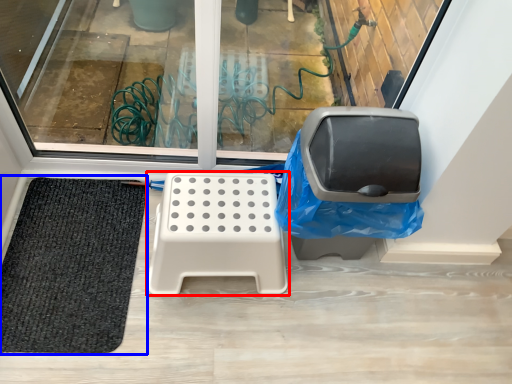
Question: Among these objects, which one is farthest to the camera, furniture (highlighted by a red box) or mat (highlighted by a blue box)?

Choices:
 (A) furniture
 (B) mat

Answer: (B)